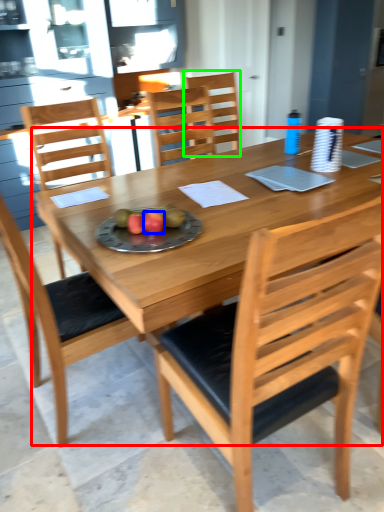
Question: Based on their relative distances, which object is farther from kitchen & dining room table (highlighted by a red box)? Choose from fruit (highlighted by a blue box) and chair (highlighted by a green box).

Choices:
 (A) fruit
 (B) chair

Answer: (B)